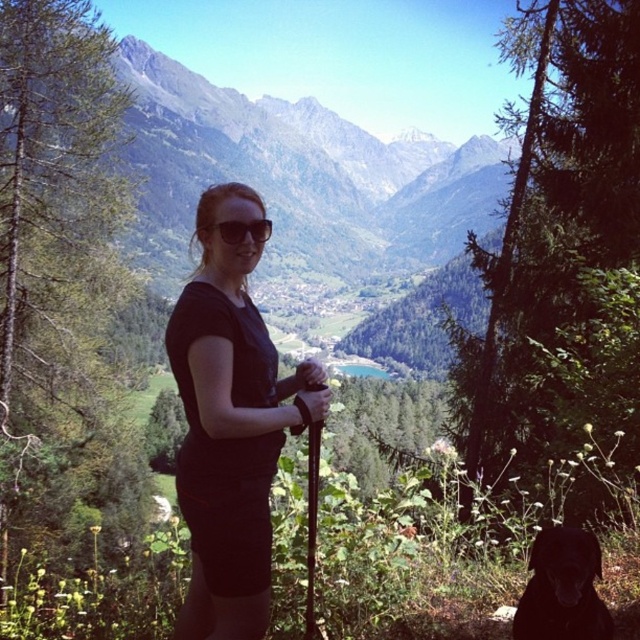
You are planning to take a photo of the green forested mountain at center and the black matte dog at lower right. Which object will occupy more space in the photo frame?

The green forested mountain at center will occupy more space in the photo frame because its width surpasses that of the black matte dog at lower right.

You are a photographer trying to capture the person in the scene. You need to adjust your camera focus to ensure both the black matte shirt at center and the matte black sunglasses at center are in focus. Which object should you focus on first to achieve this?

The black matte shirt at center is below matte black sunglasses at center. To ensure both are in focus, you should focus on the matte black sunglasses at center first since it is closer to the camera, allowing the depth of field to cover the shirt below it.